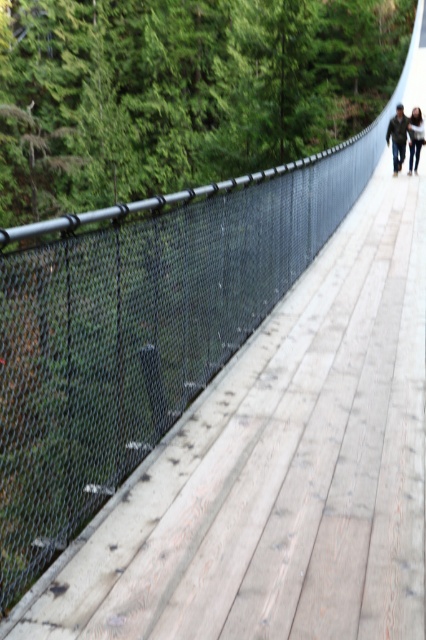
Which is more to the right, blurred denim jacket at upper center or light brown leather jacket at upper center?

Positioned to the right is light brown leather jacket at upper center.

This screenshot has height=640, width=426. Describe the element at coordinates (402, 134) in the screenshot. I see `blurred denim jacket at upper center` at that location.

Is point (412, 131) positioned in front of point (420, 124)?

No, (412, 131) is behind (420, 124).

Where is `blurred denim jacket at upper center`? The width and height of the screenshot is (426, 640). blurred denim jacket at upper center is located at coordinates (402, 134).